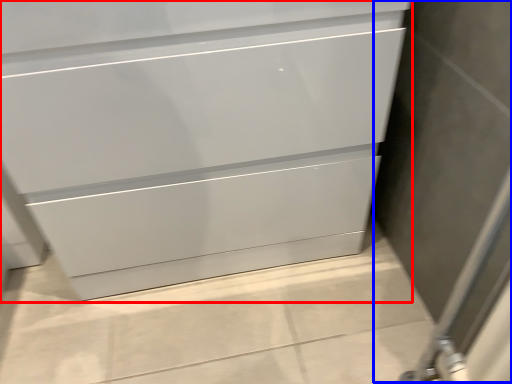
Question: Which object appears closest to the camera in this image, chest of drawers (highlighted by a red box) or screen door (highlighted by a blue box)?

Choices:
 (A) chest of drawers
 (B) screen door

Answer: (B)